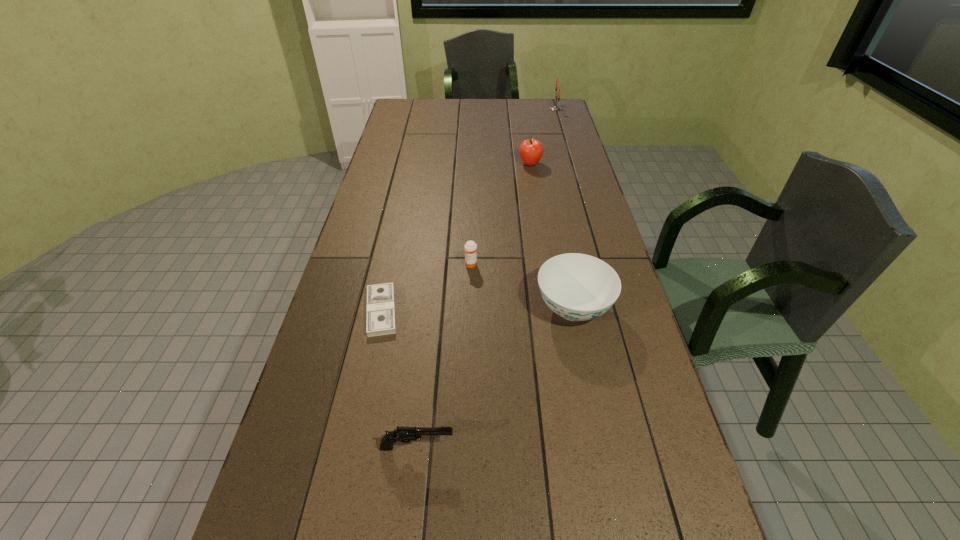
Where is `candle`? The height and width of the screenshot is (540, 960). candle is located at coordinates click(554, 108).

Locate an element on the screen. Image resolution: width=960 pixels, height=540 pixels. the fifth nearest object is located at coordinates (531, 150).

This screenshot has height=540, width=960. What are the coordinates of `chinaware` in the screenshot? It's located at (578, 287).

This screenshot has height=540, width=960. I want to click on gun, so click(403, 434).

Identify the location of the nearest object. (403, 434).

This screenshot has height=540, width=960. I want to click on the third farthest object, so click(x=470, y=247).

Locate an element on the screen. The height and width of the screenshot is (540, 960). medicine is located at coordinates (470, 247).

Identify the location of the leftmost object. (380, 320).

At what (x,y) coordinates should I click in order to perform the action: click on the shortest object. Please return your answer as a coordinate pair (x, y). The width and height of the screenshot is (960, 540). Looking at the image, I should click on (380, 320).

In order to click on vacant space situated on the front-facing side of the candle in this screenshot , I will do `click(522, 109)`.